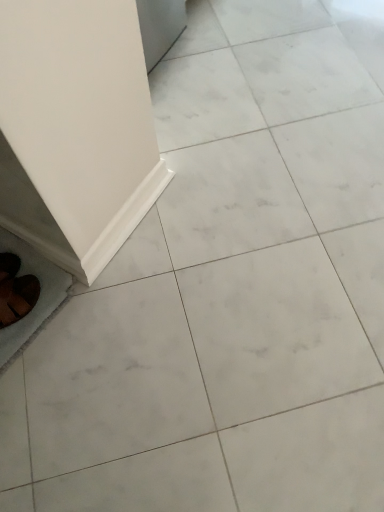
Question: From a real-world perspective, is brown suede shoes at lower left on white glossy ceramic tile at lower left, the first ceramic tile viewed from the left?

Choices:
 (A) yes
 (B) no

Answer: (A)

Question: Does brown suede shoes at lower left have a greater height compared to white glossy ceramic tile at lower left, the first ceramic tile viewed from the left?

Choices:
 (A) no
 (B) yes

Answer: (B)

Question: Is brown suede shoes at lower left shorter than white glossy ceramic tile at lower left, the first ceramic tile viewed from the left?

Choices:
 (A) yes
 (B) no

Answer: (B)

Question: Is brown suede shoes at lower left facing away from white glossy ceramic tile at lower left, the first ceramic tile viewed from the left?

Choices:
 (A) yes
 (B) no

Answer: (B)

Question: From the image's perspective, is brown suede shoes at lower left below white glossy ceramic tile at lower left, which appears as the 2th ceramic tile when viewed from the right?

Choices:
 (A) no
 (B) yes

Answer: (B)

Question: Is point (11, 331) positioned closer to the camera than point (6, 280)?

Choices:
 (A) farther
 (B) closer

Answer: (B)

Question: Is white glossy ceramic tile at lower left, the first ceramic tile viewed from the left, spatially inside brown suede shoes at lower left, or outside of it?

Choices:
 (A) inside
 (B) outside

Answer: (B)

Question: From the image's perspective, is white glossy ceramic tile at lower left, which appears as the 2th ceramic tile when viewed from the right, above or below brown suede shoes at lower left?

Choices:
 (A) above
 (B) below

Answer: (A)

Question: Considering their positions, is white glossy ceramic tile at lower left, which appears as the 2th ceramic tile when viewed from the right, located in front of or behind brown suede shoes at lower left?

Choices:
 (A) front
 (B) behind

Answer: (B)

Question: From a real-world perspective, is white glossy baseboard at lower left, which appears as the 1th ceramic tile when viewed from the right, above or below brown suede shoes at lower left?

Choices:
 (A) above
 (B) below

Answer: (B)

Question: Would you say white glossy baseboard at lower left, which appears as the 1th ceramic tile when viewed from the right, is to the left or to the right of brown suede shoes at lower left in the picture?

Choices:
 (A) right
 (B) left

Answer: (A)

Question: From the image's perspective, relative to brown suede shoes at lower left, is white glossy baseboard at lower left, which appears as the 1th ceramic tile when viewed from the right, above or below?

Choices:
 (A) below
 (B) above

Answer: (B)

Question: In terms of height, does white glossy baseboard at lower left, the second ceramic tile from the left, look taller or shorter compared to brown suede shoes at lower left?

Choices:
 (A) short
 (B) tall

Answer: (A)

Question: In the image, is white glossy ceramic tile at lower left, the first ceramic tile viewed from the left, positioned in front of or behind white glossy baseboard at lower left, which appears as the 1th ceramic tile when viewed from the right?

Choices:
 (A) front
 (B) behind

Answer: (A)

Question: From a real-world perspective, relative to white glossy baseboard at lower left, the second ceramic tile from the left, is white glossy ceramic tile at lower left, the first ceramic tile viewed from the left, vertically above or below?

Choices:
 (A) above
 (B) below

Answer: (B)